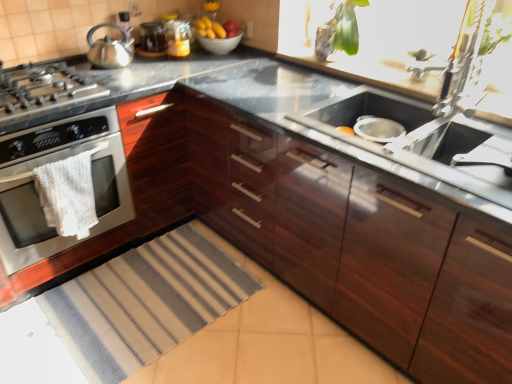
You are a GUI agent. You are given a task and a screenshot of the screen. Output one action in this format:
    pyautogui.click(x=<x>, y=<y>)
    Task: Click on the polished stainless steel kettle at left
    The width and height of the screenshot is (512, 384).
    Given the screenshot: What is the action you would take?
    pyautogui.click(x=110, y=49)

This screenshot has height=384, width=512. What do you see at coordinates (37, 193) in the screenshot? I see `satin silver oven at left` at bounding box center [37, 193].

What is the approximate height of red matte apple at upper center?

red matte apple at upper center is 2.82 inches tall.

You are a GUI agent. You are given a task and a screenshot of the screen. Output one action in this format:
    pyautogui.click(x=<x>, y=<y>)
    Task: Click on the matte glass jar at upper center
    This screenshot has width=512, height=384.
    Given the screenshot: What is the action you would take?
    (151, 40)

Describe the element at coordinates (418, 156) in the screenshot. I see `stainless steel sink at center` at that location.

Identify the location of stainless steel sink at center. The image size is (512, 384). (418, 156).

This screenshot has height=384, width=512. Describe the element at coordinates (340, 237) in the screenshot. I see `glossy wood cabinets at center` at that location.

At what (x,y) coordinates should I click in order to perform the action: click on yellow matte bananas at upper center. Please return your answer as a coordinate pair (x, y). The width and height of the screenshot is (512, 384). Looking at the image, I should click on (214, 29).

I want to click on metallic silver faucet at upper right, so click(462, 63).

From the image's perspective, between satin silver gas stove at left and white woven towel at left, who is located below?

white woven towel at left appears lower in the image.

Is satin silver gas stove at left closer to camera compared to white woven towel at left?

Yes, it is.

Can you tell me how much satin silver gas stove at left and white woven towel at left differ in facing direction?

The angular difference between satin silver gas stove at left and white woven towel at left is 3.46 degrees.

Is satin silver gas stove at left facing away from white woven towel at left?

That's not correct — satin silver gas stove at left is not looking away from white woven towel at left.

Are metallic silver faucet at upper right and glossy wood cabinets at center located far from each other?

No, metallic silver faucet at upper right is not far from glossy wood cabinets at center.

Is metallic silver faucet at upper right positioned with its back to glossy wood cabinets at center?

That's not correct — metallic silver faucet at upper right is not looking away from glossy wood cabinets at center.

In terms of height, does metallic silver faucet at upper right look taller or shorter compared to glossy wood cabinets at center?

Clearly, metallic silver faucet at upper right is shorter compared to glossy wood cabinets at center.

Which of these two, matte glass jar at upper center or white glossy bowl at upper center, is bigger?

white glossy bowl at upper center is bigger.

From a real-world perspective, is matte glass jar at upper center located beneath white glossy bowl at upper center?

No, from a real-world perspective, matte glass jar at upper center is not beneath white glossy bowl at upper center.

Is point (163, 46) in front of point (223, 54)?

That is True.

Can we say matte glass jar at upper center lies outside white glossy bowl at upper center?

matte glass jar at upper center is positioned outside white glossy bowl at upper center.

Is matte glass jar at upper center looking in the opposite direction of metallic silver faucet at upper right?

No.

Considering the sizes of matte glass jar at upper center and metallic silver faucet at upper right in the image, is matte glass jar at upper center taller or shorter than metallic silver faucet at upper right?

Clearly, matte glass jar at upper center is shorter compared to metallic silver faucet at upper right.

Would you say matte glass jar at upper center contains metallic silver faucet at upper right?

Actually, metallic silver faucet at upper right is outside matte glass jar at upper center.

Looking at this image, does metallic silver faucet at upper right touch striped fabric rug at lower left?

There is a gap between metallic silver faucet at upper right and striped fabric rug at lower left.

From their relative heights in the image, would you say metallic silver faucet at upper right is taller or shorter than striped fabric rug at lower left?

metallic silver faucet at upper right is taller than striped fabric rug at lower left.

Can you confirm if metallic silver faucet at upper right is thinner than striped fabric rug at lower left?

Correct, the width of metallic silver faucet at upper right is less than that of striped fabric rug at lower left.

Is metallic silver faucet at upper right inside or outside of striped fabric rug at lower left?

metallic silver faucet at upper right cannot be found inside striped fabric rug at lower left.

Which of these two, yellow matte bananas at upper center or white glossy bowl at upper center, is wider?

white glossy bowl at upper center is wider.

Considering the relative positions of yellow matte bananas at upper center and white glossy bowl at upper center in the image provided, is yellow matte bananas at upper center behind white glossy bowl at upper center?

No, the depth of yellow matte bananas at upper center is less than that of white glossy bowl at upper center.

From the picture: Considering the sizes of yellow matte bananas at upper center and white glossy bowl at upper center in the image, is yellow matte bananas at upper center taller or shorter than white glossy bowl at upper center?

In the image, yellow matte bananas at upper center appears to be taller than white glossy bowl at upper center.

Image resolution: width=512 pixels, height=384 pixels. In the image, there is a matte glass jar at upper center. In order to click on material below it (from a real-world perspective) in this screenshot , I will do `click(68, 194)`.

Is white woven towel at left smaller than matte glass jar at upper center?

No, white woven towel at left is not smaller than matte glass jar at upper center.

Is white woven towel at left beside matte glass jar at upper center?

No, white woven towel at left is not making contact with matte glass jar at upper center.

I want to click on gas stove that is in front of the white woven towel at left, so click(44, 89).

Where is `faucet to the right of glossy wood cabinets at center`? The width and height of the screenshot is (512, 384). faucet to the right of glossy wood cabinets at center is located at coordinates (462, 63).

When comparing their distances from white glossy bowl at upper center, does white woven towel at left or glossy wood cabinets at center seem closer?

white woven towel at left lies closer to white glossy bowl at upper center than the other object.

Looking at the image, which one is located closer to metallic silver faucet at upper right, white glossy bowl at upper center or stainless steel sink at center?

Among the two, stainless steel sink at center is located nearer to metallic silver faucet at upper right.

Estimate the real-world distances between objects in this image. Which object is closer to yellow matte bananas at upper center, satin silver oven at left or metallic silver faucet at upper right?

satin silver oven at left is positioned closer to the anchor yellow matte bananas at upper center.

Considering their positions, is white woven towel at left positioned further to polished stainless steel kettle at left than satin silver gas stove at left?

The object further to polished stainless steel kettle at left is white woven towel at left.

Considering their positions, is striped fabric rug at lower left positioned further to matte glass jar at upper center than yellow matte bananas at upper center?

The object further to matte glass jar at upper center is striped fabric rug at lower left.

Consider the image. Estimate the real-world distances between objects in this image. Which object is further from glossy wood cabinets at center, metallic silver faucet at upper right or satin silver oven at left?

metallic silver faucet at upper right.

From the image, which object appears to be nearer to metallic silver faucet at upper right, white glossy bowl at upper center or polished stainless steel kettle at left?

Based on the image, white glossy bowl at upper center appears to be nearer to metallic silver faucet at upper right.

Based on their spatial positions, is red matte apple at upper center or matte glass jar at upper center closer to polished stainless steel kettle at left?

matte glass jar at upper center is positioned closer to the anchor polished stainless steel kettle at left.

Where is `kitchen appliance between white glossy bowl at upper center and striped fabric rug at lower left in the vertical direction`? This screenshot has width=512, height=384. kitchen appliance between white glossy bowl at upper center and striped fabric rug at lower left in the vertical direction is located at coordinates (110, 49).

You are a GUI agent. You are given a task and a screenshot of the screen. Output one action in this format:
    pyautogui.click(x=<x>, y=<y>)
    Task: Click on the appliance between polished stainless steel kettle at left and metallic silver faucet at upper right in the horizontal direction
    This screenshot has height=384, width=512.
    Given the screenshot: What is the action you would take?
    pyautogui.click(x=151, y=40)

Image resolution: width=512 pixels, height=384 pixels. Find the location of `material between satin silver oven at left and striped fabric rug at lower left in the up-down direction`. material between satin silver oven at left and striped fabric rug at lower left in the up-down direction is located at coordinates (68, 194).

The image size is (512, 384). Find the location of `cabinetry located between polished stainless steel kettle at left and stainless steel sink at center in the left-right direction`. cabinetry located between polished stainless steel kettle at left and stainless steel sink at center in the left-right direction is located at coordinates (340, 237).